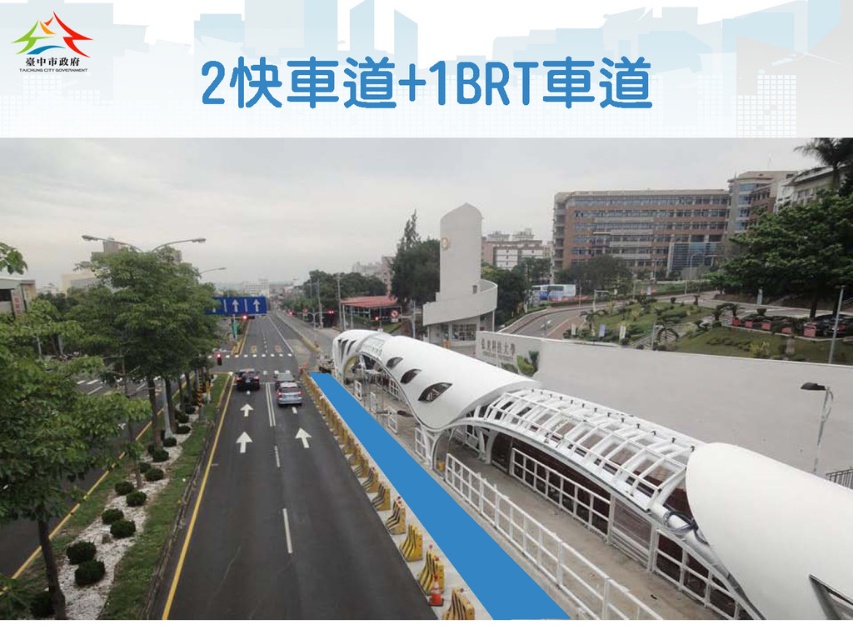
Which is above, white translucent canopy at right or shiny black car at center?

white translucent canopy at right

Is point (764, 465) in front of point (238, 384)?

That is True.

The image size is (853, 640). In order to click on white translucent canopy at right in this screenshot , I will do `click(639, 481)`.

Based on the photo, is black asphalt highway at center positioned before matte silver car at center?

That is True.

Which is more to the right, black asphalt highway at center or matte silver car at center?

black asphalt highway at center is more to the right.

Measure the distance between point (287, 481) and camera.

Point (287, 481) is 77.91 feet from camera.

Where is `black asphalt highway at center`? black asphalt highway at center is located at coordinates (285, 528).

Describe the element at coordinates (285, 528) in the screenshot. I see `black asphalt highway at center` at that location.

Looking at this image, is black asphalt highway at center taller than shiny black car at center?

Yes, black asphalt highway at center is taller than shiny black car at center.

I want to click on black asphalt highway at center, so [285, 528].